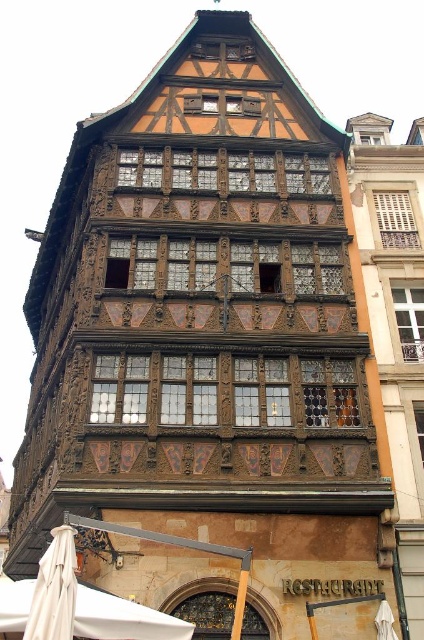
Is white fabric canopy at lower left to the left of beige fabric umbrella at lower left from the viewer's perspective?

Yes, white fabric canopy at lower left is to the left of beige fabric umbrella at lower left.

Which is more to the right, white fabric canopy at lower left or beige fabric umbrella at lower left?

Positioned to the right is beige fabric umbrella at lower left.

Does point (120, 636) come in front of point (61, 637)?

That is False.

Locate an element on the screen. This screenshot has height=640, width=424. white fabric canopy at lower left is located at coordinates (122, 618).

Does white fabric canopy at lower left have a lesser height compared to white fabric umbrella at lower right?

No.

The height and width of the screenshot is (640, 424). I want to click on white fabric canopy at lower left, so click(x=122, y=618).

Image resolution: width=424 pixels, height=640 pixels. What are the coordinates of `white fabric canopy at lower left` in the screenshot? It's located at (122, 618).

Measure the distance between beige fabric umbrella at lower left and camera.

68.37 feet

Is beige fabric umbrella at lower left wider than white fabric umbrella at lower right?

Indeed, beige fabric umbrella at lower left has a greater width compared to white fabric umbrella at lower right.

Does point (25, 625) lie in front of point (384, 602)?

Yes, point (25, 625) is in front of point (384, 602).

Identify the location of beige fabric umbrella at lower left. [55, 589].